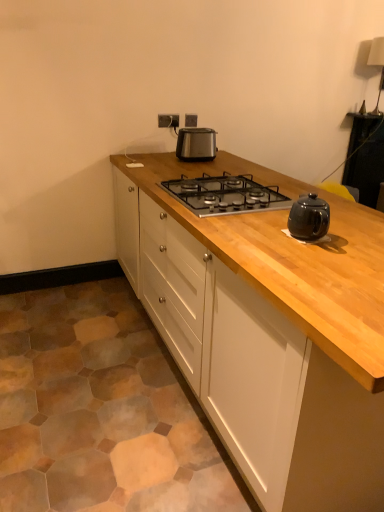
Question: From a real-world perspective, is satin silver outlet at upper center under natural wood cabinet at center?

Choices:
 (A) yes
 (B) no

Answer: (B)

Question: From the image's perspective, is satin silver outlet at upper center above natural wood cabinet at center?

Choices:
 (A) no
 (B) yes

Answer: (B)

Question: Is satin silver outlet at upper center positioned behind natural wood cabinet at center?

Choices:
 (A) no
 (B) yes

Answer: (B)

Question: Considering the relative sizes of satin silver outlet at upper center and natural wood cabinet at center in the image provided, is satin silver outlet at upper center smaller than natural wood cabinet at center?

Choices:
 (A) yes
 (B) no

Answer: (A)

Question: Is satin silver outlet at upper center outside of natural wood cabinet at center?

Choices:
 (A) no
 (B) yes

Answer: (B)

Question: From a real-world perspective, is black glass gas stove at center physically located above or below satin silver outlet at upper center?

Choices:
 (A) above
 (B) below

Answer: (B)

Question: Is point (253, 206) positioned closer to the camera than point (162, 121)?

Choices:
 (A) closer
 (B) farther

Answer: (A)

Question: Which is correct: black glass gas stove at center is inside satin silver outlet at upper center, or outside of it?

Choices:
 (A) inside
 (B) outside

Answer: (B)

Question: From the image's perspective, is black glass gas stove at center above or below satin silver outlet at upper center?

Choices:
 (A) above
 (B) below

Answer: (B)

Question: Which is correct: satin silver outlet at upper center is inside satin black toaster at center, or outside of it?

Choices:
 (A) outside
 (B) inside

Answer: (A)

Question: Is point click(x=177, y=120) positioned closer to the camera than point click(x=208, y=144)?

Choices:
 (A) closer
 (B) farther

Answer: (B)

Question: From the image's perspective, is satin silver outlet at upper center positioned above or below satin black toaster at center?

Choices:
 (A) above
 (B) below

Answer: (A)

Question: Relative to satin black toaster at center, is satin silver outlet at upper center in front or behind?

Choices:
 (A) front
 (B) behind

Answer: (B)

Question: Does point (175, 121) appear closer or farther from the camera than point (306, 485)?

Choices:
 (A) closer
 (B) farther

Answer: (B)

Question: Considering the positions of satin silver outlet at upper center and natural wood cabinet at center in the image, is satin silver outlet at upper center bigger or smaller than natural wood cabinet at center?

Choices:
 (A) small
 (B) big

Answer: (A)